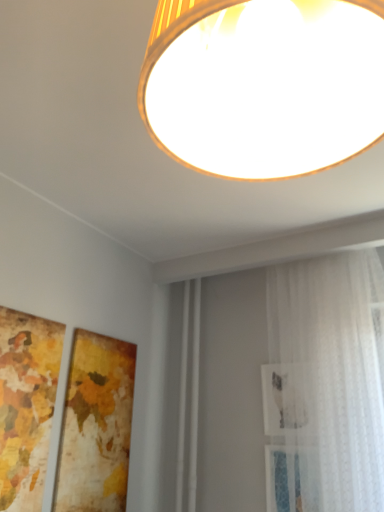
Question: Does wooden map at left, which ranks as the second picture frame in right-to-left order, turn towards white sheer curtain at right?

Choices:
 (A) no
 (B) yes

Answer: (A)

Question: Considering the relative sizes of wooden map at left, the 1th picture frame viewed from the left, and white sheer curtain at right in the image provided, is wooden map at left, the 1th picture frame viewed from the left, bigger than white sheer curtain at right?

Choices:
 (A) no
 (B) yes

Answer: (A)

Question: Does wooden map at left, the 1th picture frame viewed from the left, touch white sheer curtain at right?

Choices:
 (A) yes
 (B) no

Answer: (B)

Question: From a real-world perspective, is wooden map at left, which ranks as the second picture frame in right-to-left order, physically above white sheer curtain at right?

Choices:
 (A) no
 (B) yes

Answer: (A)

Question: Is white sheer curtain at right completely or partially inside wooden map at left, the 1th picture frame viewed from the left?

Choices:
 (A) yes
 (B) no

Answer: (B)

Question: Are wooden map at left, the 1th picture frame viewed from the left, and white sheer curtain at right far apart?

Choices:
 (A) no
 (B) yes

Answer: (B)

Question: From the image's perspective, is white sheer curtain at right below matte gold lampshade at upper center?

Choices:
 (A) no
 (B) yes

Answer: (B)

Question: From a real-world perspective, is white sheer curtain at right positioned over matte gold lampshade at upper center based on gravity?

Choices:
 (A) yes
 (B) no

Answer: (B)

Question: Is white sheer curtain at right wider than matte gold lampshade at upper center?

Choices:
 (A) no
 (B) yes

Answer: (B)

Question: Can matte gold lampshade at upper center be found inside white sheer curtain at right?

Choices:
 (A) yes
 (B) no

Answer: (B)

Question: Considering the relative sizes of white sheer curtain at right and matte gold lampshade at upper center in the image provided, is white sheer curtain at right smaller than matte gold lampshade at upper center?

Choices:
 (A) yes
 (B) no

Answer: (B)

Question: Is matte gold lampshade at upper center at the back of white sheer curtain at right?

Choices:
 (A) yes
 (B) no

Answer: (B)

Question: Is wooden textured frame at lower left, the second picture frame positioned from the left, positioned beyond the bounds of white sheer curtain at right?

Choices:
 (A) no
 (B) yes

Answer: (B)